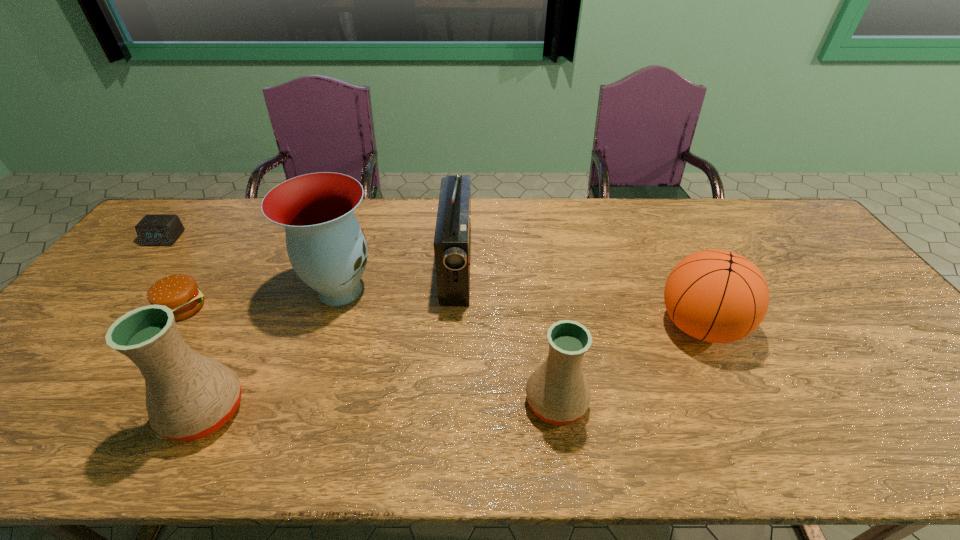
You are a GUI agent. You are given a task and a screenshot of the screen. Output one action in this format:
    pyautogui.click(x=<x>, y=<y>)
    Task: Click on the object that is at the left edge
    
    Given the screenshot: What is the action you would take?
    pos(153,230)

At what (x,y) coordinates should I click in order to perform the action: click on object at the far left corner. Please return your answer as a coordinate pair (x, y). This screenshot has height=540, width=960. Looking at the image, I should click on [153, 230].

You are a GUI agent. You are given a task and a screenshot of the screen. Output one action in this format:
    pyautogui.click(x=<x>, y=<y>)
    Task: Click on the free space at the far edge of the desktop
    
    Given the screenshot: What is the action you would take?
    pyautogui.click(x=248, y=236)

Locate an element on the screen. blank space at the near edge is located at coordinates (425, 409).

The width and height of the screenshot is (960, 540). Identify the location of vacant region at the left edge of the desktop. (143, 260).

This screenshot has height=540, width=960. What are the coordinates of `vacant position at the right edge of the desktop` in the screenshot? It's located at (797, 264).

Image resolution: width=960 pixels, height=540 pixels. Identify the location of vacant space in between the taller pottery and the fourth object from left to right. (273, 351).

Find the location of a particular element. The image size is (960, 540). free space between the third object from left to right and the second object from right to left is located at coordinates (381, 407).

At what (x,y) coordinates should I click in order to perform the action: click on free space between the sixth object from right to left and the shorter pottery. Please return your answer as a coordinate pair (x, y). The height and width of the screenshot is (540, 960). Looking at the image, I should click on pyautogui.click(x=370, y=355).

This screenshot has width=960, height=540. Find the location of `free space that is in between the shorter pottery and the basketball`. free space that is in between the shorter pottery and the basketball is located at coordinates (628, 364).